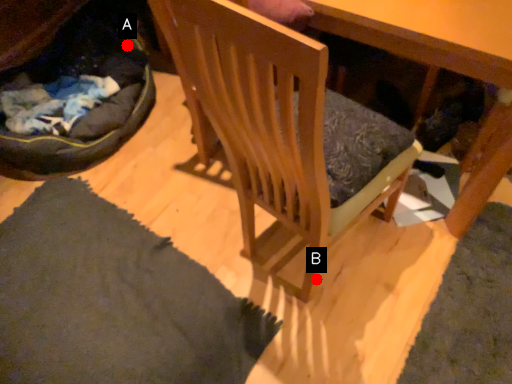
Question: Two points are circled on the image, labeled by A and B beside each circle. Which point is farther to the camera?

Choices:
 (A) A is further
 (B) B is further

Answer: (A)